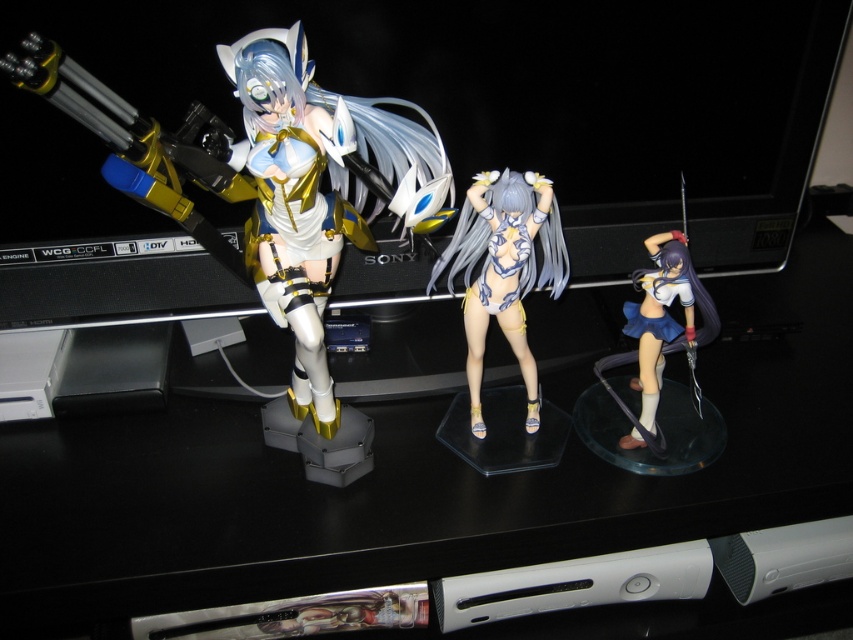
Can you confirm if black plastic computer desk at center is taller than matte white plastic figure at left?

Yes, black plastic computer desk at center is taller than matte white plastic figure at left.

Does point (154, 518) lie behind point (325, 369)?

Yes.

Where is `black plastic computer desk at center`? The height and width of the screenshot is (640, 853). black plastic computer desk at center is located at coordinates (408, 484).

Is matte white plastic figure at left above satin white bikini at center?

Yes.

Who is more forward, (242, 81) or (454, 237)?

Positioned in front is point (242, 81).

Identify the location of matte white plastic figure at left. This screenshot has height=640, width=853. (264, 177).

Does point (537, 396) come farther from viewer compared to point (643, 428)?

Yes.

Who is more distant from viewer, (447,250) or (636,326)?

Point (636,326)

Image resolution: width=853 pixels, height=640 pixels. Identify the location of satin white bikini at center. (503, 272).